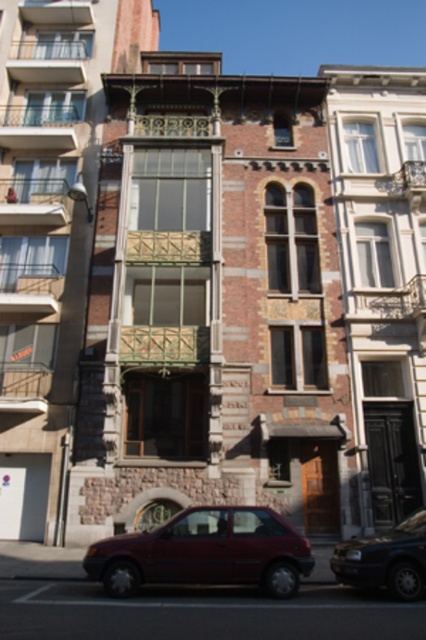
Question: Among these objects, which one is nearest to the camera?

Choices:
 (A) matte red car at lower center
 (B) metallic car at lower center

Answer: (B)

Question: Where is matte red car at lower center located in relation to dark blue metallic car at lower right in the image?

Choices:
 (A) above
 (B) below

Answer: (A)

Question: Does matte red car at lower center appear on the left side of dark blue metallic car at lower right?

Choices:
 (A) yes
 (B) no

Answer: (A)

Question: Is matte red car at lower center below dark blue metallic car at lower right?

Choices:
 (A) no
 (B) yes

Answer: (A)

Question: Among these objects, which one is farthest from the camera?

Choices:
 (A) matte red car at lower center
 (B) dark blue metallic car at lower right

Answer: (A)

Question: Which object appears closest to the camera in this image?

Choices:
 (A) metallic car at lower center
 (B) dark blue metallic car at lower right
 (C) matte red car at lower center

Answer: (A)